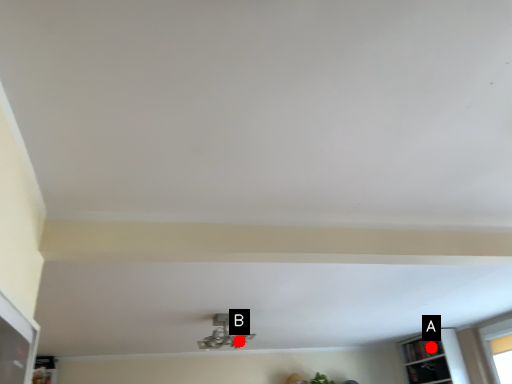
Question: Two points are circled on the image, labeled by A and B beside each circle. Which point is farther to the camera?

Choices:
 (A) A is further
 (B) B is further

Answer: (A)